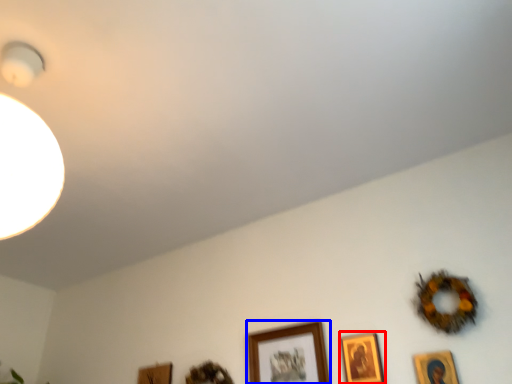
Question: Among these objects, which one is farthest to the camera, picture frame (highlighted by a red box) or picture frame (highlighted by a blue box)?

Choices:
 (A) picture frame
 (B) picture frame

Answer: (B)